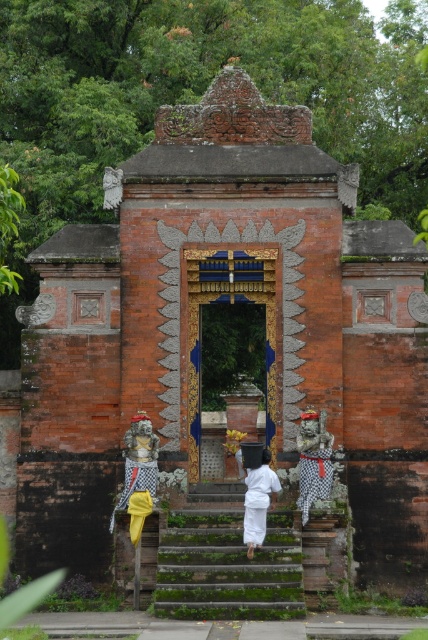
Is point (273, 374) closer to camera compared to point (133, 477)?

That is False.

You are a GUI agent. You are given a task and a screenshot of the screen. Output one action in this format:
    pyautogui.click(x=<x>, y=<y>)
    Task: Click on the blue painted wood door at center
    Image resolution: width=428 pixels, height=640 pixels.
    Given the screenshot: What is the action you would take?
    pyautogui.click(x=231, y=304)

Measure the distance from green mossy stairs at center to checkered fabric statue at right.

The distance of green mossy stairs at center from checkered fabric statue at right is 6.60 meters.

Which is behind, point (241, 544) or point (309, 477)?

The point (309, 477) is more distant.

Is point (270, 614) closer to camera compared to point (323, 472)?

Yes.

This screenshot has width=428, height=640. I want to click on green mossy stairs at center, so click(x=226, y=561).

The image size is (428, 640). What do you see at coordinates (231, 304) in the screenshot?
I see `blue painted wood door at center` at bounding box center [231, 304].

Which is behind, point (216, 292) or point (252, 524)?

The point (216, 292) is behind.

Is point (192, 429) closer to camera compared to point (264, 483)?

No, (192, 429) is behind (264, 483).

Locate an element on the screen. This screenshot has height=640, width=428. blue painted wood door at center is located at coordinates (231, 304).